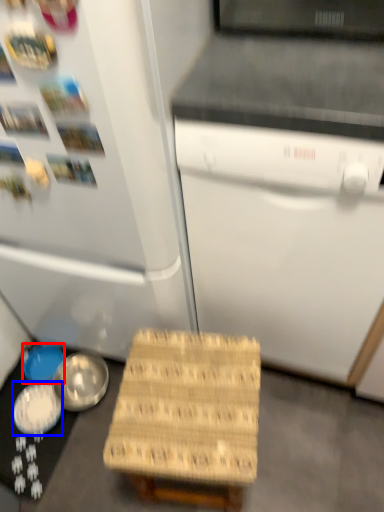
Question: Which object appears closest to the camera in this image, bowl (highlighted by a red box) or bowl (highlighted by a blue box)?

Choices:
 (A) bowl
 (B) bowl

Answer: (B)